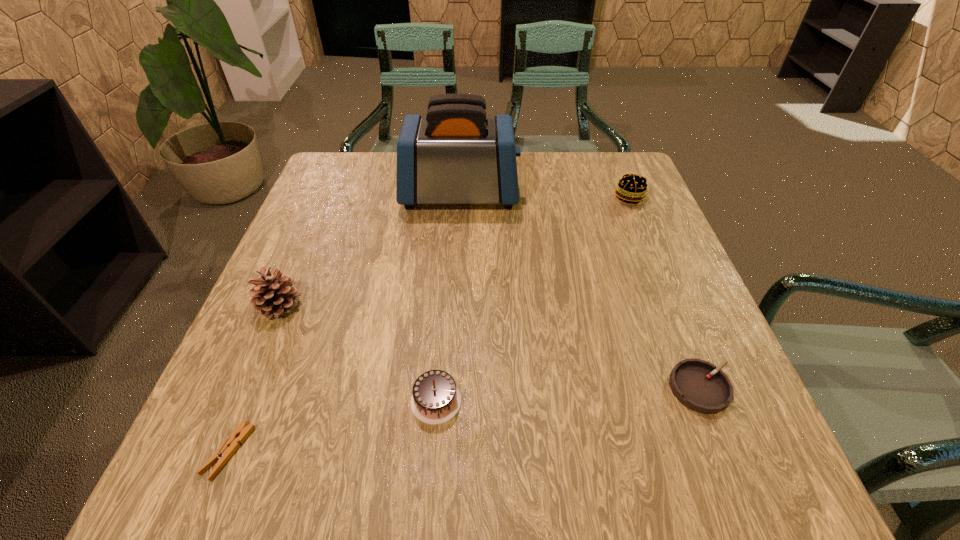
I want to click on vacant space located on the left of the chocolate cake, so click(x=229, y=401).

You are a GUI agent. You are given a task and a screenshot of the screen. Output one action in this format:
    pyautogui.click(x=<x>, y=<y>)
    Task: Click on the vacant space located on the back of the ashtray
    
    Given the screenshot: What is the action you would take?
    pyautogui.click(x=650, y=260)

The width and height of the screenshot is (960, 540). Identify the location of vacant space positioned 0.140m on the back of the shortest object. (270, 350).

What are the coordinates of `toaster located at the far edge` in the screenshot? It's located at (456, 154).

Locate an element on the screen. The image size is (960, 540). patty that is at the far edge is located at coordinates (631, 188).

This screenshot has width=960, height=540. Find the location of `object that is at the near edge`. object that is at the near edge is located at coordinates (231, 444).

I want to click on pinecone at the left edge, so click(x=273, y=295).

The width and height of the screenshot is (960, 540). I want to click on clothespin located in the left edge section of the desktop, so click(231, 444).

Where is `patty located at the right edge`? This screenshot has height=540, width=960. patty located at the right edge is located at coordinates (631, 188).

Where is `ashtray that is at the right edge`? This screenshot has height=540, width=960. ashtray that is at the right edge is located at coordinates (699, 385).